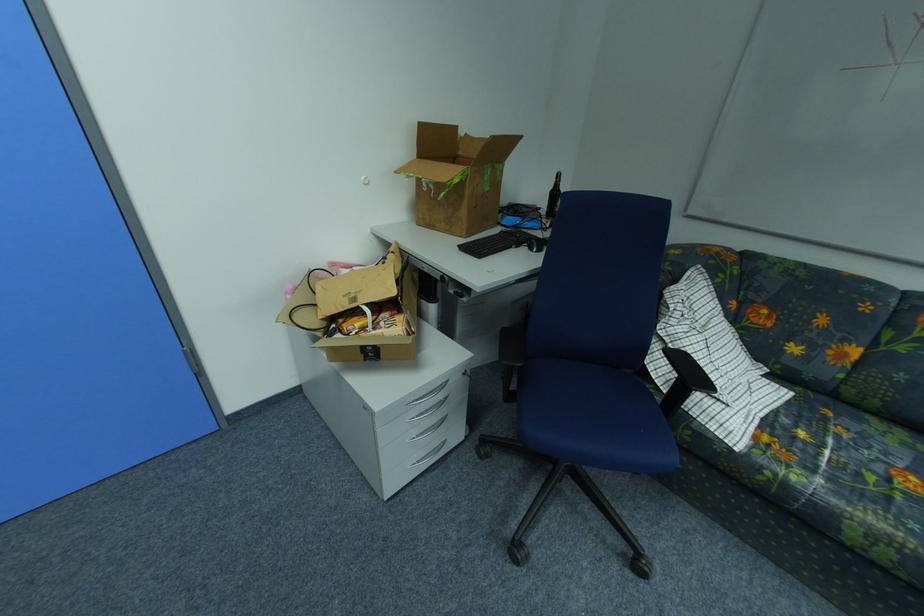
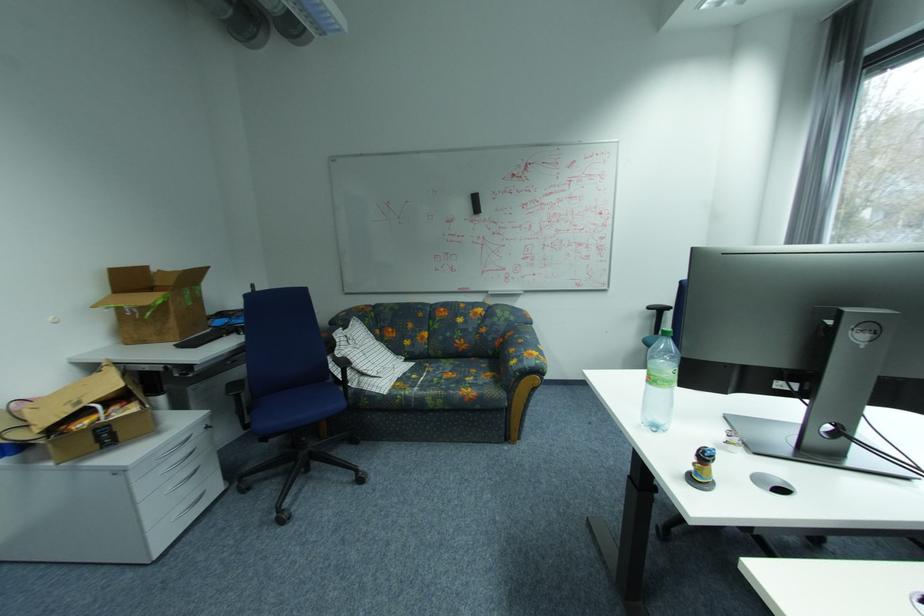
In the second image, find the point that corresponds to pixel 804 479 in the first image.

(416, 392)